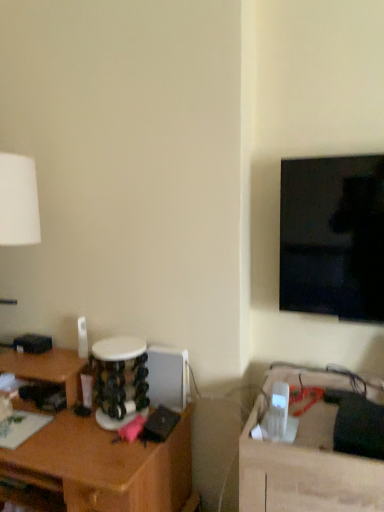
This screenshot has width=384, height=512. Identify the location of black glossy tv at upper right. (333, 237).

Is wooden table at lower right not inside brown wood desk at left?

Yes, wooden table at lower right is outside of brown wood desk at left.

Would you consider wooden table at lower right to be distant from brown wood desk at left?

Actually, wooden table at lower right and brown wood desk at left are a little close together.

How far apart are wooden table at lower right and brown wood desk at left?

20.80 inches.

Locate an element on the screen. table located above the brown wood desk at left (from the image's perspective) is located at coordinates (306, 469).

Is black glossy tv at upper right in front of or behind brown wood desk at left in the image?

Visually, black glossy tv at upper right is located behind brown wood desk at left.

Is point (287, 231) closer to camera compared to point (175, 478)?

Yes, point (287, 231) is in front of point (175, 478).

From a real-world perspective, does black glossy tv at upper right sit lower than brown wood desk at left?

No, from a real-world perspective, black glossy tv at upper right is not below brown wood desk at left.

From the image's perspective, is black glossy tv at upper right located above or below brown wood desk at left?

black glossy tv at upper right is above brown wood desk at left.

Considering the positions of point (341, 466) and point (310, 225), is point (341, 466) closer or farther from the camera than point (310, 225)?

Point (341, 466) is positioned closer to the camera compared to point (310, 225).

Is wooden table at lower right far from black glossy tv at upper right?

No.

Consider the image. Is wooden table at lower right looking in the opposite direction of black glossy tv at upper right?

That's not correct — wooden table at lower right is not looking away from black glossy tv at upper right.

Which of these two, wooden table at lower right or black glossy tv at upper right, stands shorter?

black glossy tv at upper right.

Which is in front, point (323, 240) or point (380, 503)?

The point (380, 503) is in front.

Is wooden table at lower right at the back of black glossy tv at upper right?

No, black glossy tv at upper right's orientation is not away from wooden table at lower right.

Do you think black glossy tv at upper right is within wooden table at lower right, or outside of it?

black glossy tv at upper right is outside wooden table at lower right.

From the picture: Which object is further away from the camera taking this photo, black glossy tv at upper right or wooden table at lower right?

black glossy tv at upper right is behind.

From the image's perspective, is brown wood desk at left located above black glossy tv at upper right?

No, from the image's perspective, brown wood desk at left is not on top of black glossy tv at upper right.

Is brown wood desk at left inside the boundaries of black glossy tv at upper right, or outside?

brown wood desk at left exists outside the volume of black glossy tv at upper right.

Between brown wood desk at left and black glossy tv at upper right, which one appears on the left side from the viewer's perspective?

Positioned to the left is brown wood desk at left.

Is brown wood desk at left next to black glossy tv at upper right and touching it?

brown wood desk at left is not next to black glossy tv at upper right, and they're not touching.

Is brown wood desk at left not inside wooden table at lower right?

That's correct, brown wood desk at left is outside of wooden table at lower right.

In terms of size, does brown wood desk at left appear bigger or smaller than wooden table at lower right?

Considering their sizes, brown wood desk at left takes up more space than wooden table at lower right.

Could you tell me if brown wood desk at left is facing wooden table at lower right?

No.

Considering the positions of objects brown wood desk at left and wooden table at lower right in the image provided, who is behind, brown wood desk at left or wooden table at lower right?

brown wood desk at left.

Find the location of a particular element. desk below the wooden table at lower right (from a real-world perspective) is located at coordinates (96, 451).

At what (x,y) coordinates should I click in order to perform the action: click on television above the brown wood desk at left (from a real-world perspective). Please return your answer as a coordinate pair (x, y). The image size is (384, 512). Looking at the image, I should click on (333, 237).

Based on their spatial positions, is brown wood desk at left or black glossy tv at upper right closer to wooden table at lower right?

black glossy tv at upper right lies closer to wooden table at lower right than the other object.

Which object lies nearer to the anchor point brown wood desk at left, wooden table at lower right or black glossy tv at upper right?

wooden table at lower right is closer to brown wood desk at left.

In the scene shown: Considering their positions, is wooden table at lower right positioned closer to black glossy tv at upper right than brown wood desk at left?

wooden table at lower right lies closer to black glossy tv at upper right than the other object.

Estimate the real-world distances between objects in this image. Which object is closer to brown wood desk at left, black glossy tv at upper right or wooden table at lower right?

The object closer to brown wood desk at left is wooden table at lower right.

Considering their positions, is black glossy tv at upper right positioned further to wooden table at lower right than brown wood desk at left?

brown wood desk at left.

Estimate the real-world distances between objects in this image. Which object is closer to black glossy tv at upper right, brown wood desk at left or wooden table at lower right?

wooden table at lower right is closer to black glossy tv at upper right.

Locate an element on the screen. This screenshot has width=384, height=512. table located between brown wood desk at left and black glossy tv at upper right in the left-right direction is located at coordinates (306, 469).